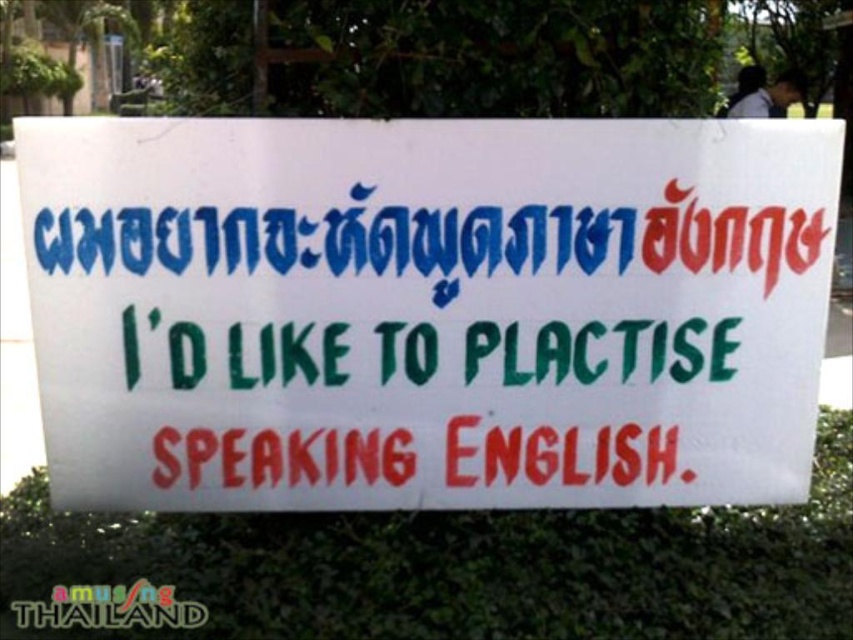
Question: In this image, where is white paper sign at center located relative to green leafy hedge at center?

Choices:
 (A) above
 (B) below

Answer: (A)

Question: Among these objects, which one is nearest to the camera?

Choices:
 (A) green leafy hedge at center
 (B) white paper sign at center

Answer: (A)

Question: Which of the following is the closest to the observer?

Choices:
 (A) green leafy hedge at center
 (B) white paper sign at center

Answer: (A)

Question: From the image, what is the correct spatial relationship of white paper sign at center in relation to green leafy hedge at center?

Choices:
 (A) right
 (B) left

Answer: (B)

Question: Which object appears closest to the camera in this image?

Choices:
 (A) green leafy hedge at center
 (B) white paper sign at center

Answer: (A)

Question: Does white paper sign at center lie in front of green leafy hedge at center?

Choices:
 (A) yes
 (B) no

Answer: (B)